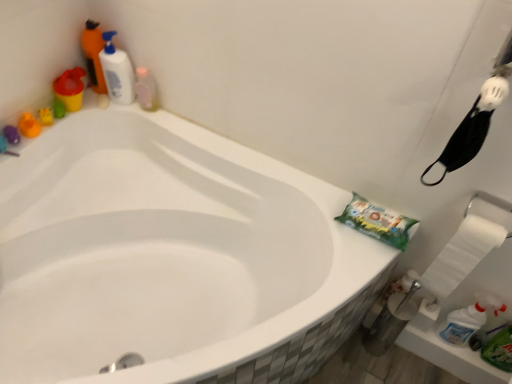
What is the approximate width of green paper towel at upper right?

It is 13.36 centimeters.

What is the approximate width of white paper towel at right?

white paper towel at right is 2.58 inches in width.

The width and height of the screenshot is (512, 384). Describe the element at coordinates (93, 55) in the screenshot. I see `translucent plastic bottle at upper left, acting as the 3th cleaning product starting from the right` at that location.

This screenshot has height=384, width=512. Describe the element at coordinates (117, 71) in the screenshot. I see `white glossy bottle at upper left, acting as the second cleaning product starting from the left` at that location.

Where is `translucent plastic bottle at upper left, positioned as the 1th cleaning product in right-to-left order`? translucent plastic bottle at upper left, positioned as the 1th cleaning product in right-to-left order is located at coordinates (146, 89).

Is green paper towel at upper right inside the boundaries of white paper towel at right, or outside?

green paper towel at upper right is spatially situated outside white paper towel at right.

Considering the relative sizes of green paper towel at upper right and white paper towel at right in the image provided, is green paper towel at upper right shorter than white paper towel at right?

Correct, green paper towel at upper right is not as tall as white paper towel at right.

Is green paper towel at upper right positioned far away from white paper towel at right?

No, green paper towel at upper right is not far away from white paper towel at right.

Is green paper towel at upper right wider or thinner than white paper towel at right?

In the image, green paper towel at upper right appears to be wider than white paper towel at right.

Considering the sizes of objects translucent plastic bottle at upper left, acting as the third cleaning product starting from the left, and white paper towel at right in the image provided, who is smaller, translucent plastic bottle at upper left, acting as the third cleaning product starting from the left, or white paper towel at right?

translucent plastic bottle at upper left, acting as the third cleaning product starting from the left, is smaller.

Does translucent plastic bottle at upper left, positioned as the 1th cleaning product in right-to-left order, appear on the right side of white paper towel at right?

No, translucent plastic bottle at upper left, positioned as the 1th cleaning product in right-to-left order, is not to the right of white paper towel at right.

Is translucent plastic bottle at upper left, positioned as the 1th cleaning product in right-to-left order, positioned in front of white paper towel at right?

No, translucent plastic bottle at upper left, positioned as the 1th cleaning product in right-to-left order, is further to the viewer.

From the image's perspective, between white glossy bottle at upper left, acting as the second cleaning product starting from the left, and white paper towel at right, who is located below?

white paper towel at right is shown below in the image.

Considering the relative sizes of white glossy bottle at upper left, acting as the second cleaning product starting from the left, and white paper towel at right in the image provided, is white glossy bottle at upper left, acting as the second cleaning product starting from the left, wider than white paper towel at right?

Indeed, white glossy bottle at upper left, acting as the second cleaning product starting from the left, has a greater width compared to white paper towel at right.

Is white glossy bottle at upper left, the second cleaning product positioned from the right, next to white paper towel at right and touching it?

They are not placed beside each other.

Do you think white glossy bottle at upper left, acting as the second cleaning product starting from the left, is within translucent plastic bottle at upper left, which is counted as the first cleaning product, starting from the left, or outside of it?

white glossy bottle at upper left, acting as the second cleaning product starting from the left, is outside translucent plastic bottle at upper left, which is counted as the first cleaning product, starting from the left.

You are a GUI agent. You are given a task and a screenshot of the screen. Output one action in this format:
    pyautogui.click(x=<x>, y=<y>)
    Task: Click on the 1st cleaning product to the right of the translucent plastic bottle at upper left, acting as the 3th cleaning product starting from the right, starting your count from the anchor
    The height and width of the screenshot is (384, 512).
    Given the screenshot: What is the action you would take?
    pyautogui.click(x=117, y=71)

Is point (106, 66) farther from camera compared to point (100, 37)?

Yes, point (106, 66) is behind point (100, 37).

Looking at their sizes, would you say white paper towel at right is wider or thinner than green paper towel at upper right?

Clearly, white paper towel at right has less width compared to green paper towel at upper right.

Is white paper towel at right spatially inside green paper towel at upper right, or outside of it?

white paper towel at right lies outside green paper towel at upper right.

Is white paper towel at right shorter than green paper towel at upper right?

No.

Considering the sizes of objects white paper towel at right and green paper towel at upper right in the image provided, who is bigger, white paper towel at right or green paper towel at upper right?

white paper towel at right.

How many degrees apart are the facing directions of green paper towel at upper right and translucent plastic bottle at upper left, positioned as the 1th cleaning product in right-to-left order?

They differ by 11.1 degrees in their facing directions.

Considering the sizes of objects green paper towel at upper right and translucent plastic bottle at upper left, positioned as the 1th cleaning product in right-to-left order, in the image provided, who is thinner, green paper towel at upper right or translucent plastic bottle at upper left, positioned as the 1th cleaning product in right-to-left order,?

translucent plastic bottle at upper left, positioned as the 1th cleaning product in right-to-left order.

Between point (373, 229) and point (147, 102), which one is positioned in front?

Positioned in front is point (373, 229).

Is green paper towel at upper right in front of or behind translucent plastic bottle at upper left, positioned as the 1th cleaning product in right-to-left order, in the image?

green paper towel at upper right is positioned closer to the viewer than translucent plastic bottle at upper left, positioned as the 1th cleaning product in right-to-left order.

From a real-world perspective, which is physically above, translucent plastic bottle at upper left, acting as the 3th cleaning product starting from the right, or white paper towel at right?

In real-world perspective, translucent plastic bottle at upper left, acting as the 3th cleaning product starting from the right, is above.

Is translucent plastic bottle at upper left, which is counted as the first cleaning product, starting from the left, at the left side of white paper towel at right?

Correct, you'll find translucent plastic bottle at upper left, which is counted as the first cleaning product, starting from the left, to the left of white paper towel at right.

Which of these two, translucent plastic bottle at upper left, which is counted as the first cleaning product, starting from the left, or white paper towel at right, is thinner?

With smaller width is white paper towel at right.

Considering the positions of point (89, 39) and point (469, 221), is point (89, 39) closer or farther from the camera than point (469, 221)?

Point (89, 39) is positioned farther from the camera compared to point (469, 221).

Where is `toilet paper directly beneath the green paper towel at upper right (from a real-world perspective)`? This screenshot has height=384, width=512. toilet paper directly beneath the green paper towel at upper right (from a real-world perspective) is located at coordinates (462, 254).

From the image's perspective, count 1st cleaning products upward from the white paper towel at right and point to it. Please provide its 2D coordinates.

[(146, 89)]

Based on their spatial positions, is white paper towel at right or translucent plastic bottle at upper left, acting as the 3th cleaning product starting from the right, closer to translucent plastic bottle at upper left, acting as the third cleaning product starting from the left?

translucent plastic bottle at upper left, acting as the 3th cleaning product starting from the right, is closer to translucent plastic bottle at upper left, acting as the third cleaning product starting from the left.

Considering their positions, is translucent plastic bottle at upper left, acting as the third cleaning product starting from the left, positioned further to translucent plastic bottle at upper left, which is counted as the first cleaning product, starting from the left, than white paper towel at right?

white paper towel at right is positioned further to the anchor translucent plastic bottle at upper left, which is counted as the first cleaning product, starting from the left.

From the image, which object appears to be farther from translucent plastic bottle at upper left, positioned as the 1th cleaning product in right-to-left order, translucent plastic bottle at upper left, acting as the 3th cleaning product starting from the right, or white paper towel at right?

white paper towel at right.

Looking at the image, which one is located closer to white paper towel at right, translucent plastic bottle at upper left, acting as the 3th cleaning product starting from the right, or green paper towel at upper right?

green paper towel at upper right.

Looking at the image, which one is located closer to green paper towel at upper right, translucent plastic bottle at upper left, which is counted as the first cleaning product, starting from the left, or translucent plastic bottle at upper left, acting as the third cleaning product starting from the left?

translucent plastic bottle at upper left, acting as the third cleaning product starting from the left, is positioned closer to the anchor green paper towel at upper right.

When comparing their distances from white glossy bottle at upper left, the second cleaning product positioned from the right, does translucent plastic bottle at upper left, positioned as the 1th cleaning product in right-to-left order, or white paper towel at right seem further?

white paper towel at right is further to white glossy bottle at upper left, the second cleaning product positioned from the right.

Estimate the real-world distances between objects in this image. Which object is further from translucent plastic bottle at upper left, acting as the third cleaning product starting from the left, translucent plastic bottle at upper left, acting as the 3th cleaning product starting from the right, or green paper towel at upper right?

The object further to translucent plastic bottle at upper left, acting as the third cleaning product starting from the left, is green paper towel at upper right.

In the scene shown: From the image, which object appears to be farther from white paper towel at right, green paper towel at upper right or translucent plastic bottle at upper left, acting as the 3th cleaning product starting from the right?

translucent plastic bottle at upper left, acting as the 3th cleaning product starting from the right.

The width and height of the screenshot is (512, 384). I want to click on material between white glossy bottle at upper left, the second cleaning product positioned from the right, and white paper towel at right from left to right, so click(x=377, y=222).

I want to click on cleaning product between white glossy bottle at upper left, acting as the second cleaning product starting from the left, and green paper towel at upper right, in the horizontal direction, so point(146,89).

You are a GUI agent. You are given a task and a screenshot of the screen. Output one action in this format:
    pyautogui.click(x=<x>, y=<y>)
    Task: Click on the cleaning product located between white glossy bottle at upper left, the second cleaning product positioned from the right, and white paper towel at right in the left-right direction
    This screenshot has height=384, width=512.
    Given the screenshot: What is the action you would take?
    pyautogui.click(x=146, y=89)

The width and height of the screenshot is (512, 384). What are the coordinates of `cleaning product between translucent plastic bottle at upper left, acting as the 3th cleaning product starting from the right, and translucent plastic bottle at upper left, acting as the third cleaning product starting from the left, in the horizontal direction` in the screenshot? It's located at (117, 71).